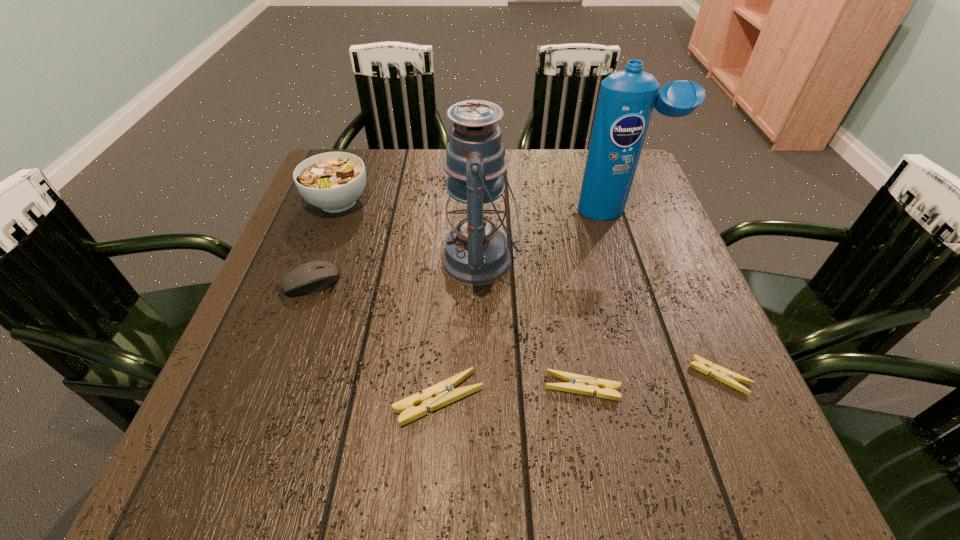
Locate an element on the screen. soup bowl present at the left edge is located at coordinates (333, 181).

Find the location of a particular element. The height and width of the screenshot is (540, 960). computer equipment that is positioned at the left edge is located at coordinates (313, 276).

At what (x,y) coordinates should I click in order to perform the action: click on clothespin that is positioned at the right edge. Please return your answer as a coordinate pair (x, y). Looking at the image, I should click on (728, 377).

You are a GUI agent. You are given a task and a screenshot of the screen. Output one action in this format:
    pyautogui.click(x=<x>, y=<y>)
    Task: Click on the shampoo located at the right edge
    
    Given the screenshot: What is the action you would take?
    pyautogui.click(x=626, y=99)

In order to click on object situated at the far left corner in this screenshot , I will do `click(333, 181)`.

The width and height of the screenshot is (960, 540). What are the coordinates of `object that is at the near right corner` in the screenshot? It's located at (728, 377).

Where is `free space at the far edge of the desktop`? This screenshot has height=540, width=960. free space at the far edge of the desktop is located at coordinates (448, 176).

Image resolution: width=960 pixels, height=540 pixels. In order to click on free location at the left edge of the desktop in this screenshot , I will do `click(302, 305)`.

Find the location of `vacant region at the right edge`. vacant region at the right edge is located at coordinates (636, 348).

I want to click on vacant area at the far left corner, so click(x=371, y=149).